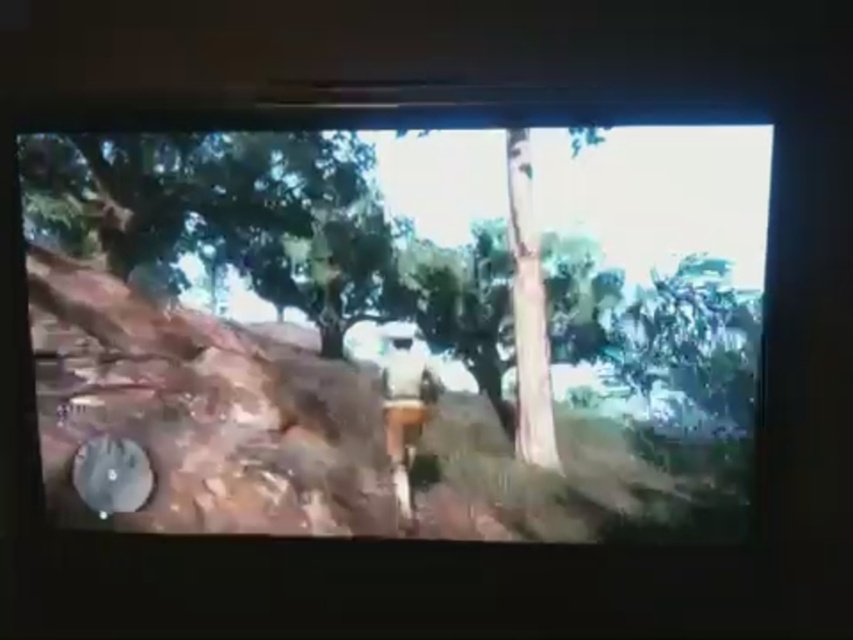
Question: Which point is farther from the camera taking this photo?

Choices:
 (A) (416, 371)
 (B) (236, 422)

Answer: (B)

Question: Observing the image, what is the correct spatial positioning of matte white helmet at center in reference to white matte shirt at center?

Choices:
 (A) right
 (B) left

Answer: (B)

Question: Is matte white helmet at center positioned behind white matte shirt at center?

Choices:
 (A) no
 (B) yes

Answer: (A)

Question: Does matte white helmet at center appear on the right side of white matte shirt at center?

Choices:
 (A) no
 (B) yes

Answer: (A)

Question: Among these objects, which one is nearest to the camera?

Choices:
 (A) matte white helmet at center
 (B) white matte shirt at center

Answer: (A)